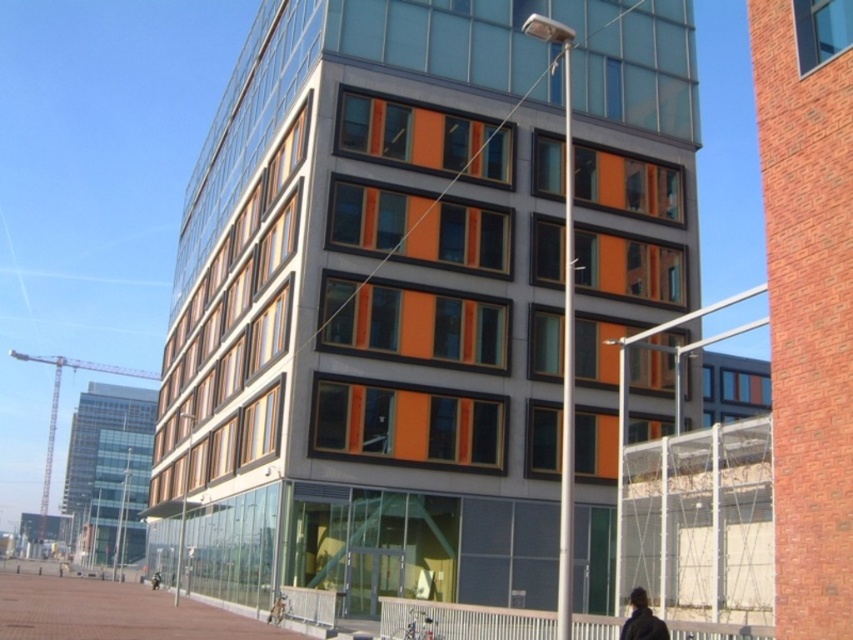
Can you confirm if brick pavement at lower left is positioned to the left of dark gray jacket at lower center?

Incorrect, brick pavement at lower left is not on the left side of dark gray jacket at lower center.

Is brick pavement at lower left thinner than dark gray jacket at lower center?

In fact, brick pavement at lower left might be wider than dark gray jacket at lower center.

Describe the element at coordinates (111, 612) in the screenshot. The image size is (853, 640). I see `brick pavement at lower left` at that location.

Where is `brick pavement at lower left`? brick pavement at lower left is located at coordinates click(111, 612).

Describe the element at coordinates (111, 612) in the screenshot. I see `brick pavement at lower left` at that location.

Find the location of `brick pavement at lower left`. brick pavement at lower left is located at coordinates (111, 612).

Is point (659, 624) farther from camera compared to point (154, 579)?

No, it is not.

Between point (647, 636) and point (155, 577), which one is positioned behind?

Positioned behind is point (155, 577).

You are a GUI agent. You are given a task and a screenshot of the screen. Output one action in this format:
    pyautogui.click(x=<x>, y=<y>)
    Task: Click on the dark brown leather jacket at lower right
    
    Given the screenshot: What is the action you would take?
    pyautogui.click(x=642, y=620)

At what (x,y) coordinates should I click in order to perform the action: click on dark brown leather jacket at lower right. Please return your answer as a coordinate pair (x, y). The height and width of the screenshot is (640, 853). Looking at the image, I should click on (642, 620).